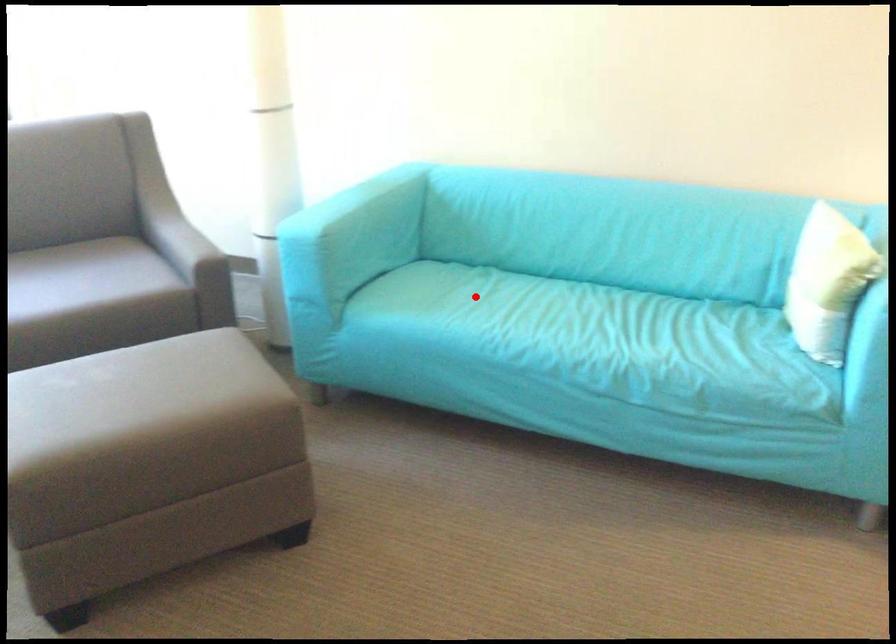
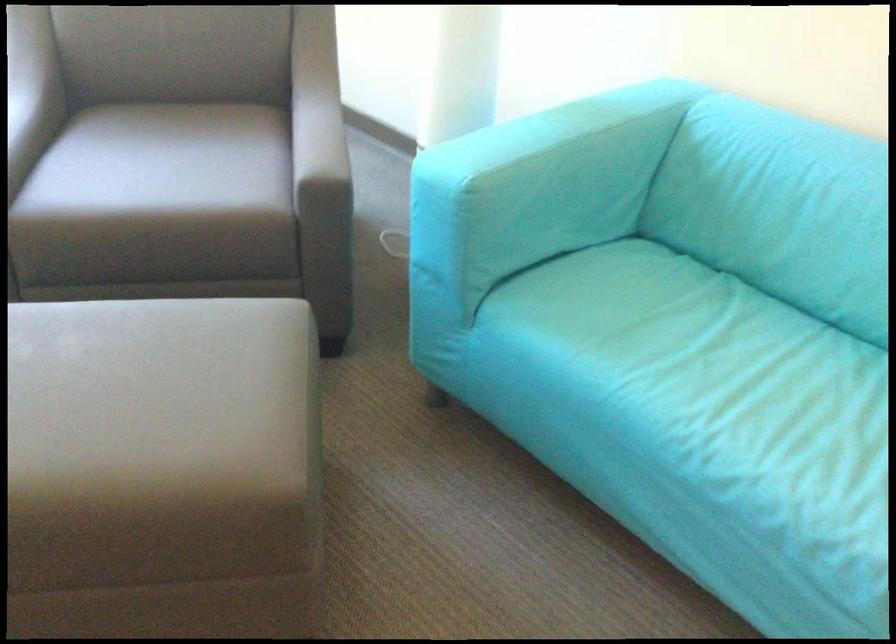
Question: I am providing you with two images of the same scene from different viewpoints. Given a red point in image1, look at the same physical point in image2. Is it:

Choices:
 (A) Closer to the viewpoint
 (B) Farther from the viewpoint

Answer: (A)